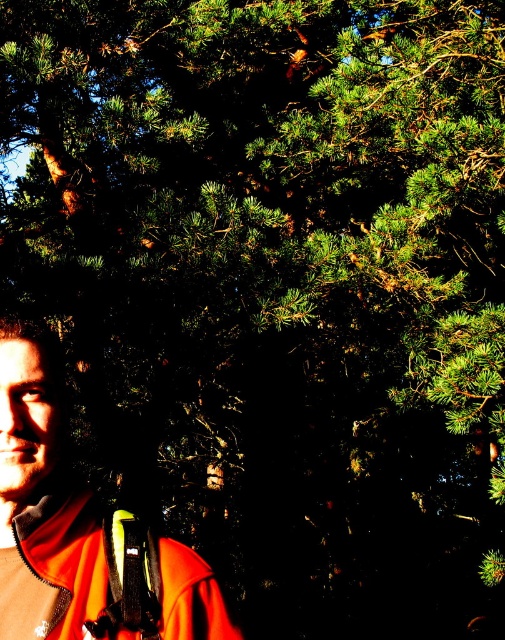
Question: Which object appears closest to the camera in this image?

Choices:
 (A) black matte strap at lower left
 (B) orange fleece jacket at lower left

Answer: (B)

Question: Which of the following is the closest to the observer?

Choices:
 (A) orange fabric jacket at left
 (B) orange fleece jacket at lower left

Answer: (A)

Question: Can you confirm if orange fabric jacket at left is smaller than orange fleece jacket at lower left?

Choices:
 (A) yes
 (B) no

Answer: (B)

Question: Is orange fleece jacket at lower left to the left of black matte strap at lower left from the viewer's perspective?

Choices:
 (A) no
 (B) yes

Answer: (B)

Question: Which object appears farthest from the camera in this image?

Choices:
 (A) orange fleece jacket at lower left
 (B) orange fabric jacket at left
 (C) black matte strap at lower left

Answer: (C)

Question: Is orange fabric jacket at left wider than orange fleece jacket at lower left?

Choices:
 (A) no
 (B) yes

Answer: (B)